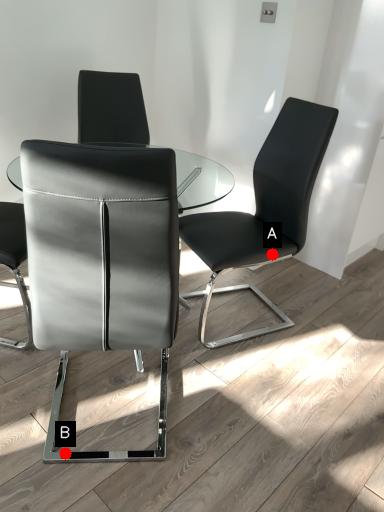
Question: Two points are circled on the image, labeled by A and B beside each circle. Which point is closer to the camera?

Choices:
 (A) A is closer
 (B) B is closer

Answer: (B)